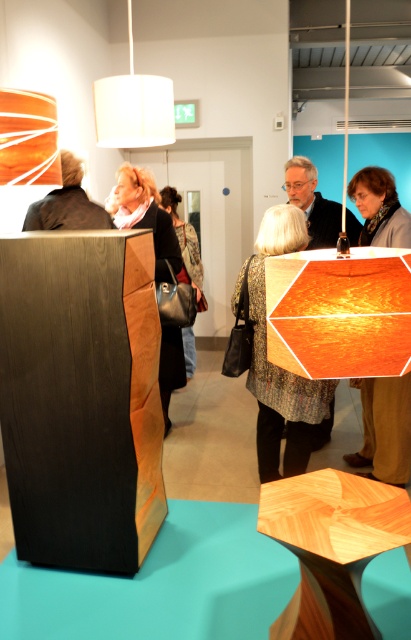
You are an assistant at a clothing store and need to determine which jacket takes up less space horizontally. You see the patterned fabric jacket at center and the matte black jacket at center. Which one is narrower?

The patterned fabric jacket at center has a lesser width compared to matte black jacket at center, so the patterned fabric jacket at center is narrower.

You are at an exhibition and see two jackets displayed at the center of the room. Which jacket is closer to you, the patterned fabric jacket at center or the matte black jacket at center?

The patterned fabric jacket at center is closer to you because it is in front of the matte black jacket at center.

You are standing in the gallery and see the point marked at coordinates (279,365). What object is located at that point?

The point at coordinates (279,365) marks the location of the patterned fabric jacket at center.